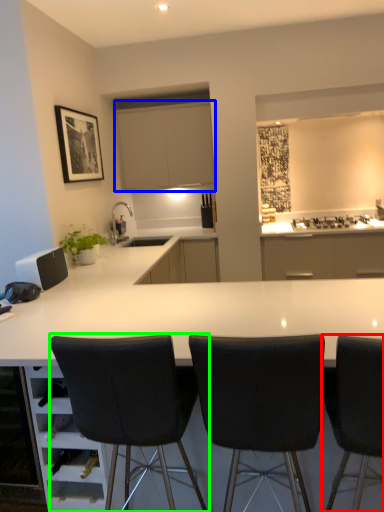
Question: Which is farther away from chair (highlighted by a red box)? cabinetry (highlighted by a blue box) or chair (highlighted by a green box)?

Choices:
 (A) cabinetry
 (B) chair

Answer: (A)